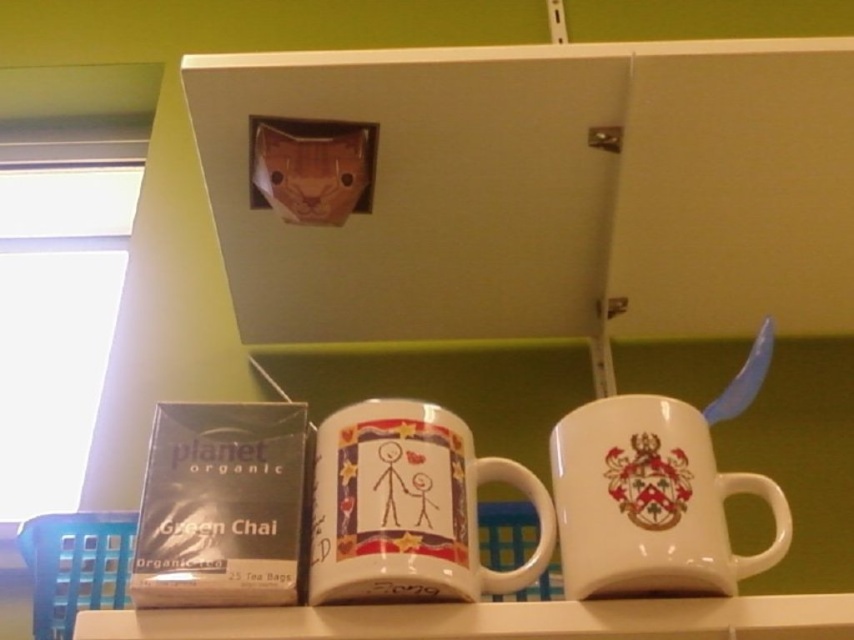
Looking at this image, is the position of white ceramic mug at center more distant than that of white glossy shelf at lower center?

Yes, it is.

Is white ceramic mug at center shorter than white glossy shelf at lower center?

No, white ceramic mug at center is not shorter than white glossy shelf at lower center.

Is point (633, 513) positioned before point (268, 632)?

No, (633, 513) is further to viewer.

The image size is (854, 640). Identify the location of white ceramic mug at center. (650, 502).

Who is positioned more to the left, matte ceramic mug at center or white ceramic mug at center?

From the viewer's perspective, matte ceramic mug at center appears more on the left side.

Is matte ceramic mug at center closer to the viewer compared to white ceramic mug at center?

Yes, it is in front of white ceramic mug at center.

Identify the location of matte ceramic mug at center. (408, 508).

Is matte ceramic mug at center to the left of white glossy shelf at lower center from the viewer's perspective?

Indeed, matte ceramic mug at center is positioned on the left side of white glossy shelf at lower center.

Identify the location of matte ceramic mug at center. The height and width of the screenshot is (640, 854). (408, 508).

Identify the location of matte ceramic mug at center. This screenshot has width=854, height=640. (408, 508).

Locate an element on the screen. matte ceramic mug at center is located at coordinates (408, 508).